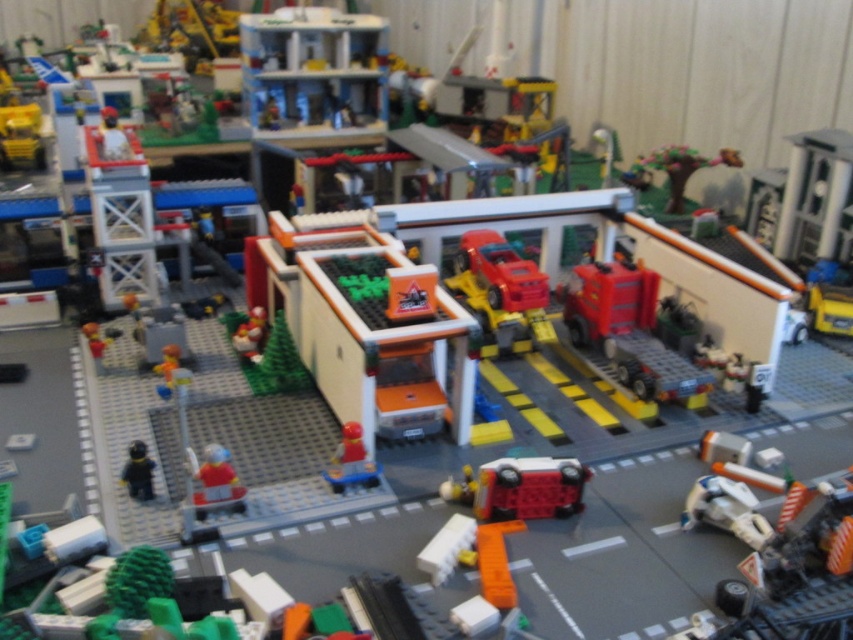
Is white plastic car at center further to the viewer compared to smooth red figure at center?

Yes.

Where is `white plastic car at center`? This screenshot has width=853, height=640. white plastic car at center is located at coordinates (520, 486).

Does point (566, 484) come farther from viewer compared to point (229, 480)?

That is True.

In order to click on white plastic car at center in this screenshot , I will do `click(520, 486)`.

Between orange matte truck at center and smooth red figure at center, which one has more height?

Standing taller between the two is orange matte truck at center.

Which is below, orange matte truck at center or smooth red figure at center?

smooth red figure at center is below.

Does point (381, 416) lie behind point (230, 472)?

Yes, it is.

This screenshot has height=640, width=853. What are the coordinates of `orange matte truck at center` in the screenshot? It's located at tap(367, 324).

Between white plastic car at center and smooth plastic minifigure at center, which one has more height?

smooth plastic minifigure at center is taller.

You are a GUI agent. You are given a task and a screenshot of the screen. Output one action in this format:
    pyautogui.click(x=<x>, y=<y>)
    Task: Click on the white plastic car at center
    The width and height of the screenshot is (853, 640).
    Given the screenshot: What is the action you would take?
    point(520,486)

What are the coordinates of `white plastic car at center` in the screenshot? It's located at (520, 486).